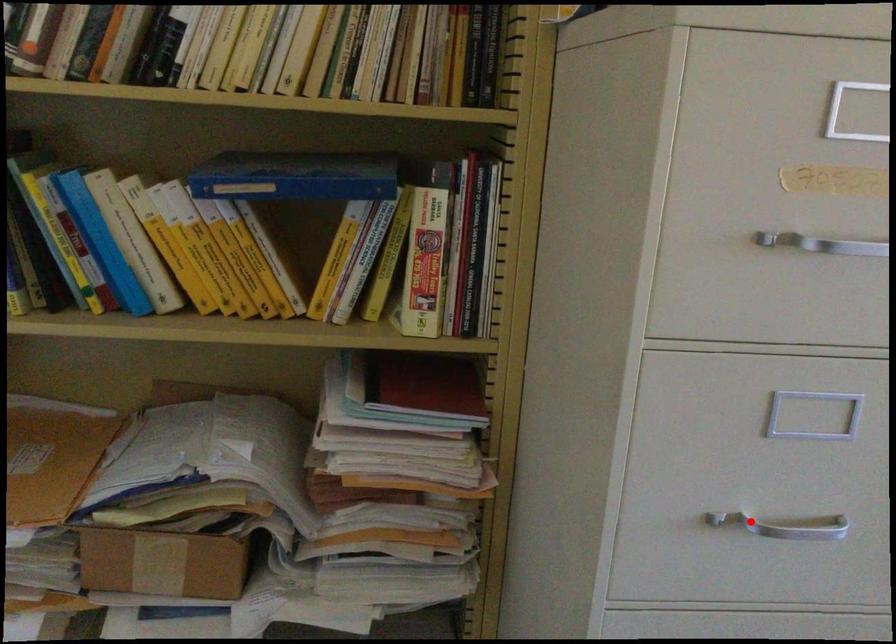
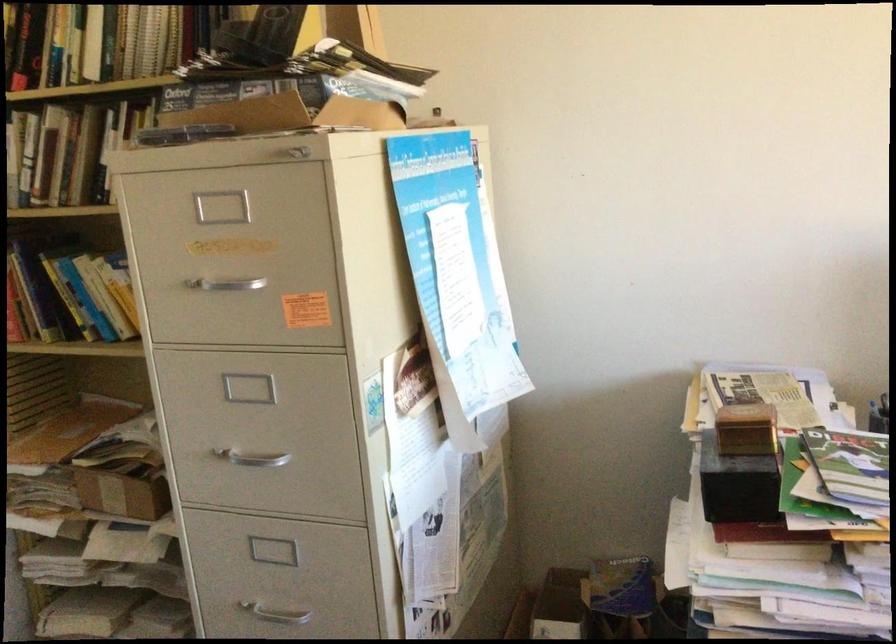
In the second image, find the point that corresponds to the highlighted location in the first image.

(251, 458)